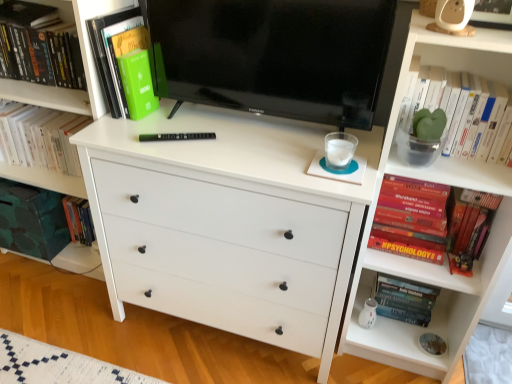
Locate an element on the screen. Image resolution: width=512 pixels, height=384 pixels. vacant space situated on the left part of white matte chest of drawers at center is located at coordinates (76, 332).